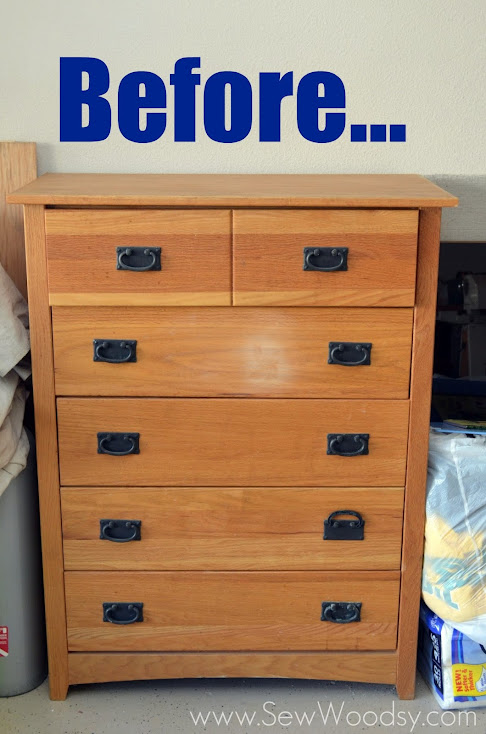
Where is `drawer door`? drawer door is located at coordinates (189, 243), (245, 243), (237, 329), (213, 415), (221, 503), (210, 595).